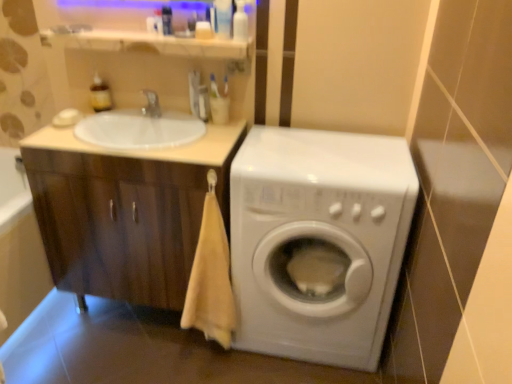
Locate an element on the screen. The height and width of the screenshot is (384, 512). free space in front of white matte soap at upper left, which is the 2th soap from top to bottom is located at coordinates (63, 140).